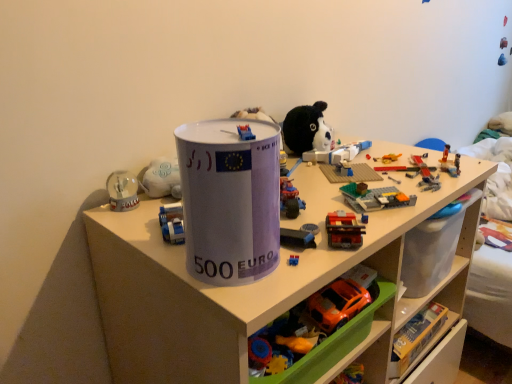
Find the location of a particular element. The image size is (512, 384). free space in front of rubberized plastic toy car at center, which appears as the 4th toy when ordered from the bottom is located at coordinates (301, 243).